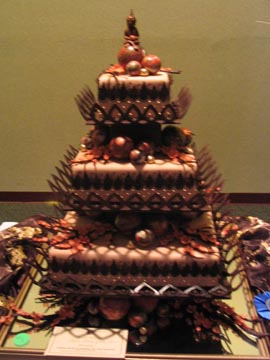
This screenshot has width=270, height=360. I want to click on spike decorations, so click(212, 180), click(232, 267), click(33, 262), click(117, 289), click(138, 118), click(185, 103).